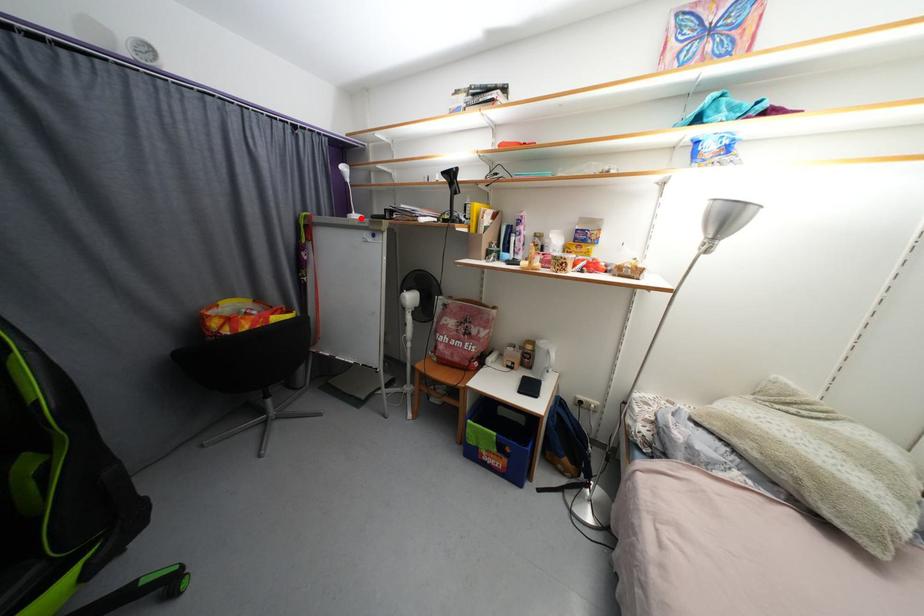
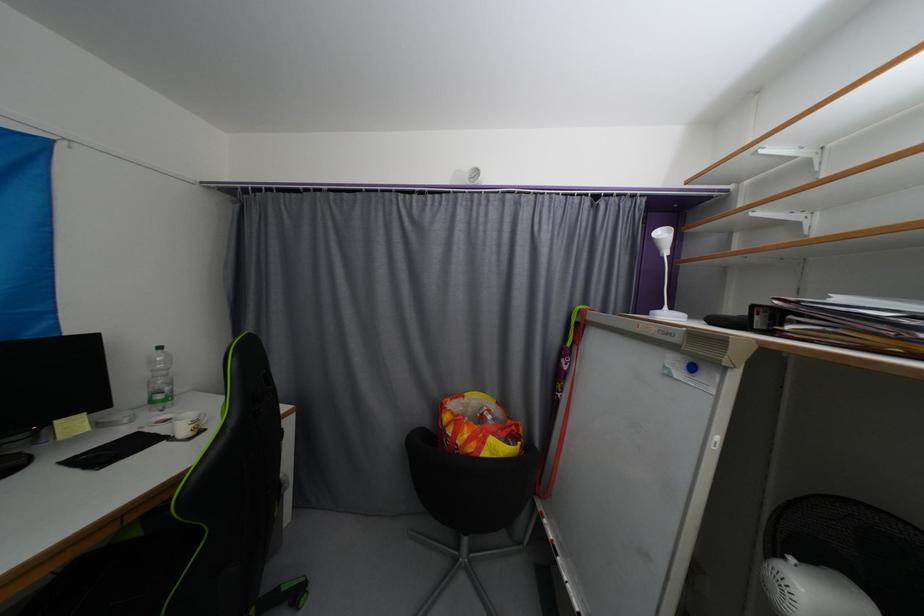
Find the pixel in the second image that matches the highlighted location in the first image.

(672, 317)